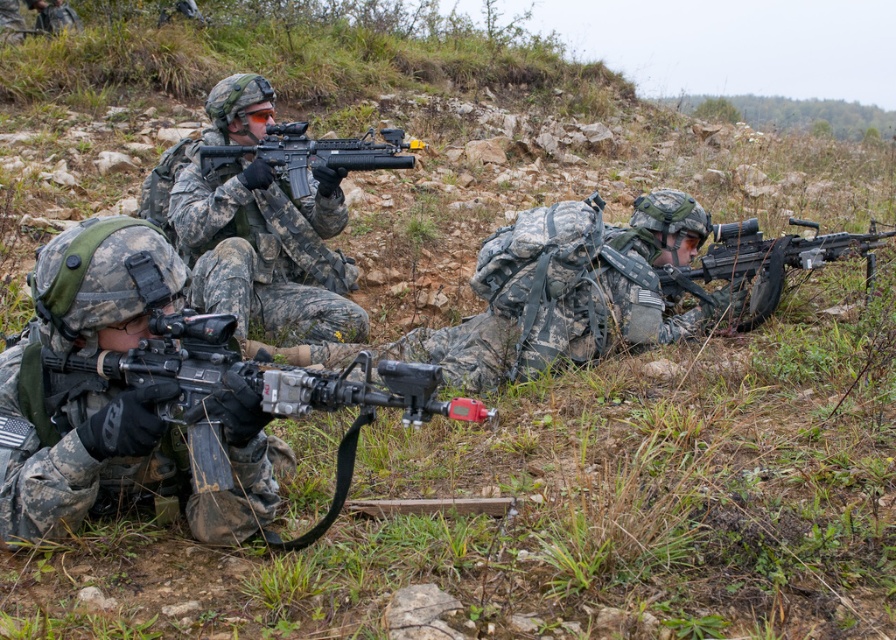
Is camouflage uniform at center closer to the viewer compared to matte black machine gun at lower left?

No, it is behind matte black machine gun at lower left.

Does camouflage uniform at center have a greater height compared to matte black machine gun at lower left?

Yes, camouflage uniform at center is taller than matte black machine gun at lower left.

Which is behind, point (175, 205) or point (343, 372)?

The point (175, 205) is more distant.

Where is `camouflage uniform at center`? The image size is (896, 640). camouflage uniform at center is located at coordinates (266, 252).

Between point (13, 456) and point (100, 355), which one is positioned in front?

Point (100, 355) is in front.

Which is behind, point (67, 467) or point (161, 410)?

Point (67, 467)

This screenshot has width=896, height=640. I want to click on camouflage fabric rifle at lower left, so click(x=75, y=445).

Locate an element on the screen. The height and width of the screenshot is (640, 896). camouflage fabric rifle at lower left is located at coordinates (75, 445).

Between camouflage uniform at center and black matte rifle at center, which one appears on the right side from the viewer's perspective?

black matte rifle at center is more to the right.

Looking at this image, does camouflage uniform at center have a larger size compared to black matte rifle at center?

Indeed, camouflage uniform at center has a larger size compared to black matte rifle at center.

Between point (322, 260) and point (375, 145), which one is positioned in front?

Point (375, 145)

Where is `camouflage uniform at center`? This screenshot has height=640, width=896. camouflage uniform at center is located at coordinates (266, 252).